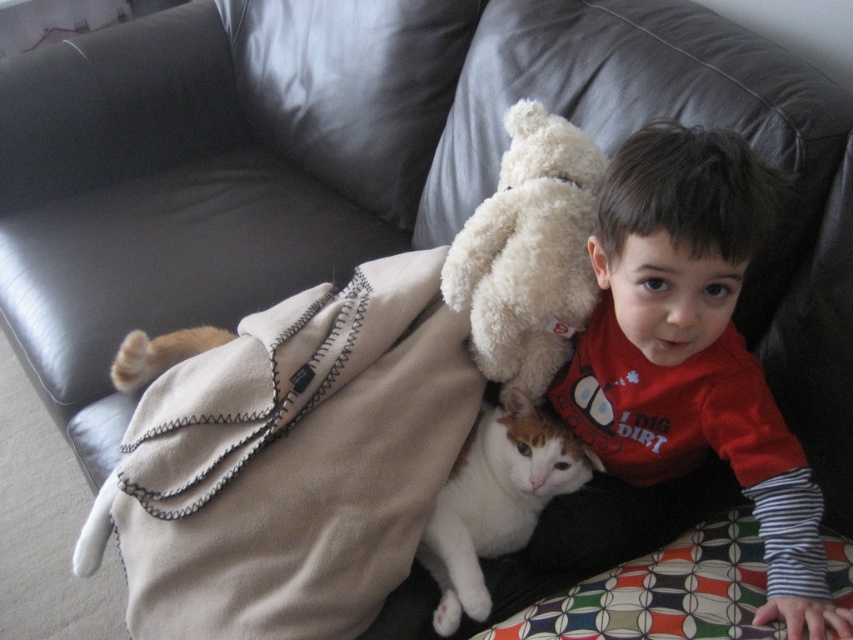
Question: Which object is the farthest from the red cotton shirt at upper right?

Choices:
 (A) fluffy beige teddy bear at upper center
 (B) beige fleece blanket at upper left

Answer: (B)

Question: Does fluffy beige teddy bear at upper center appear on the left side of white soft fur cat at lower center?

Choices:
 (A) no
 (B) yes

Answer: (A)

Question: Does beige fleece blanket at upper left appear on the left side of red cotton shirt at upper right?

Choices:
 (A) no
 (B) yes

Answer: (B)

Question: Is beige fleece blanket at upper left to the right of red cotton shirt at upper right from the viewer's perspective?

Choices:
 (A) no
 (B) yes

Answer: (A)

Question: Which object is positioned closest to the fluffy beige teddy bear at upper center?

Choices:
 (A) white soft fur cat at lower center
 (B) red cotton shirt at upper right

Answer: (B)

Question: Which object is the closest to the beige fleece blanket at upper left?

Choices:
 (A) red cotton shirt at upper right
 (B) fluffy beige teddy bear at upper center

Answer: (B)